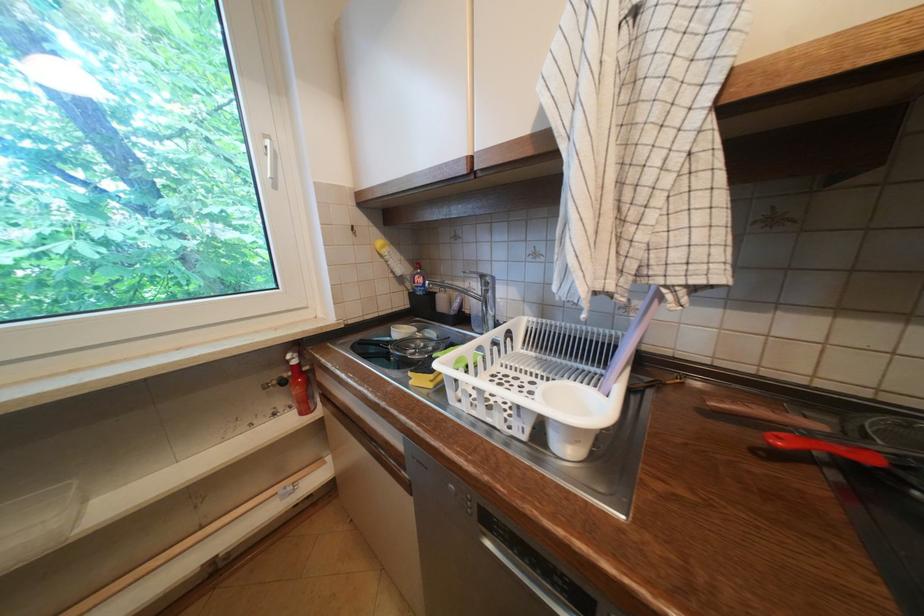
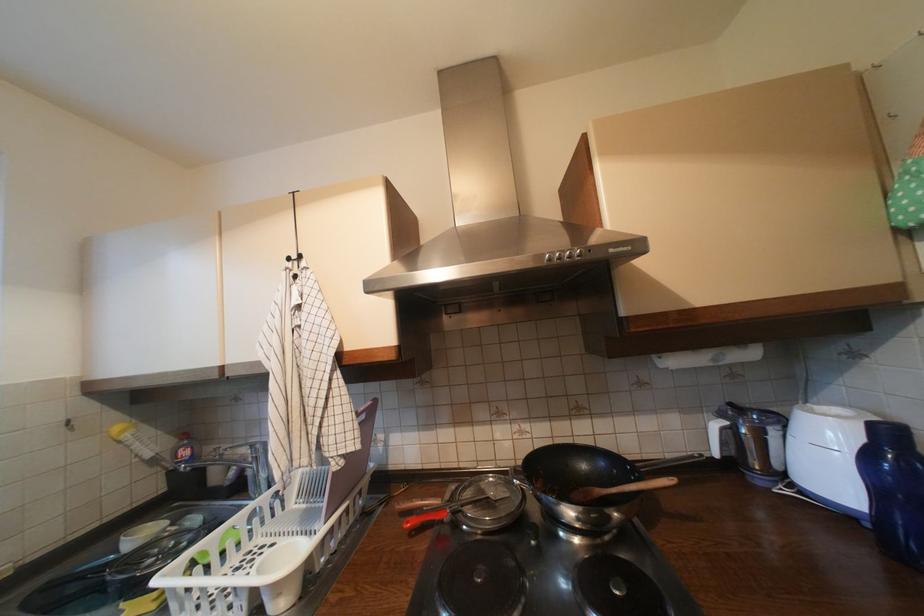
The point at (424, 270) is marked in the first image. Where is the corresponding point in the second image?

(189, 440)